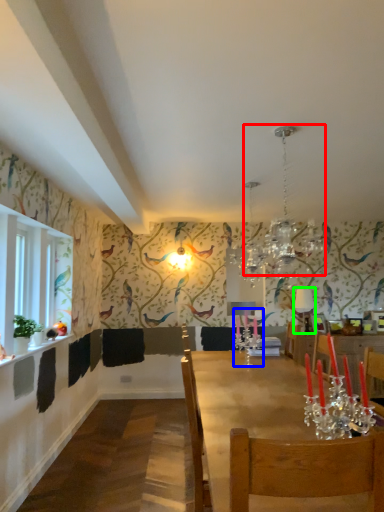
Question: Which is nearer to the light fixture (highlighted by a red box)? candle holder (highlighted by a blue box) or lamp (highlighted by a green box).

Choices:
 (A) candle holder
 (B) lamp

Answer: (B)